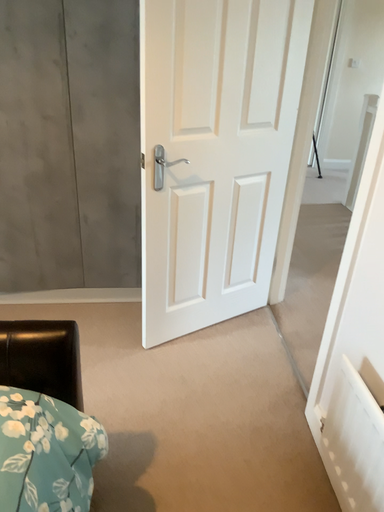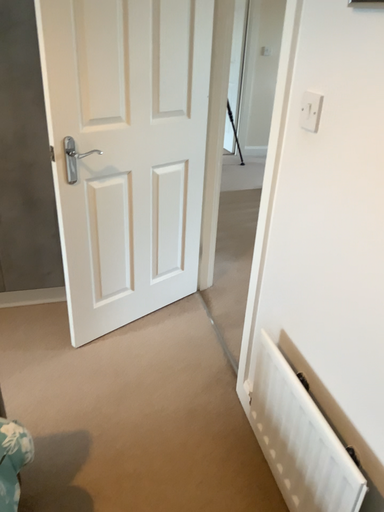
Question: How did the camera likely rotate when shooting the video?

Choices:
 (A) rotated right
 (B) rotated left

Answer: (A)